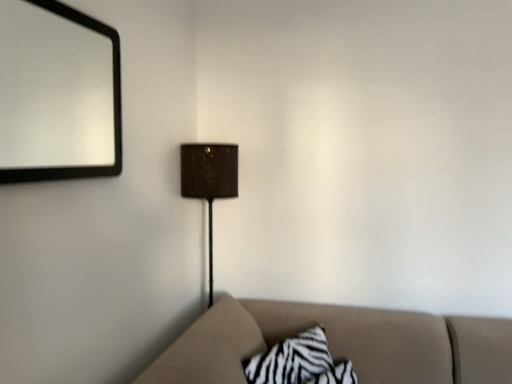
Question: Does matte brown lampshade at center have a greater height compared to black matte mirror at upper left?

Choices:
 (A) yes
 (B) no

Answer: (A)

Question: Does matte brown lampshade at center appear on the right side of black matte mirror at upper left?

Choices:
 (A) no
 (B) yes

Answer: (B)

Question: Considering the relative positions of matte brown lampshade at center and black matte mirror at upper left in the image provided, is matte brown lampshade at center to the left of black matte mirror at upper left from the viewer's perspective?

Choices:
 (A) yes
 (B) no

Answer: (B)

Question: Considering the relative sizes of matte brown lampshade at center and black matte mirror at upper left in the image provided, is matte brown lampshade at center wider than black matte mirror at upper left?

Choices:
 (A) no
 (B) yes

Answer: (B)

Question: Are matte brown lampshade at center and black matte mirror at upper left far apart?

Choices:
 (A) yes
 (B) no

Answer: (B)

Question: Is matte brown lampshade at center not inside black matte mirror at upper left?

Choices:
 (A) no
 (B) yes

Answer: (B)

Question: Is matte brown lampshade at center thinner than zebra-patterned fabric pillow at lower center?

Choices:
 (A) no
 (B) yes

Answer: (A)

Question: Does matte brown lampshade at center have a greater width compared to zebra-patterned fabric pillow at lower center?

Choices:
 (A) yes
 (B) no

Answer: (A)

Question: Is matte brown lampshade at center smaller than zebra-patterned fabric pillow at lower center?

Choices:
 (A) yes
 (B) no

Answer: (B)

Question: Does matte brown lampshade at center have a lesser height compared to zebra-patterned fabric pillow at lower center?

Choices:
 (A) no
 (B) yes

Answer: (A)

Question: From the image's perspective, would you say matte brown lampshade at center is shown under zebra-patterned fabric pillow at lower center?

Choices:
 (A) yes
 (B) no

Answer: (B)

Question: Is matte brown lampshade at center to the left of zebra-patterned fabric pillow at lower center from the viewer's perspective?

Choices:
 (A) yes
 (B) no

Answer: (A)

Question: Is the surface of black matte mirror at upper left in direct contact with matte brown lampshade at center?

Choices:
 (A) no
 (B) yes

Answer: (A)